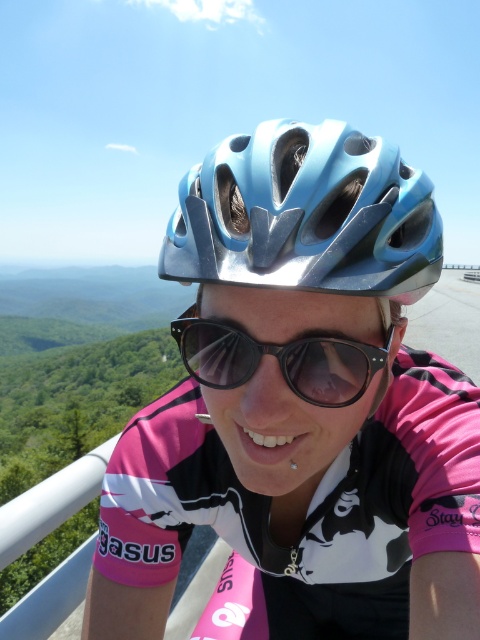
Can you confirm if blue metallic helmet at center is smaller than black matte sunglasses at center?

Indeed, blue metallic helmet at center has a smaller size compared to black matte sunglasses at center.

Is point (419, 220) closer to camera compared to point (300, 381)?

No, it is not.

In order to click on blue metallic helmet at center in this screenshot , I will do `click(305, 216)`.

Is blue glossy bicycle helmet at center smaller than blue metallic helmet at center?

Actually, blue glossy bicycle helmet at center might be larger than blue metallic helmet at center.

Does blue glossy bicycle helmet at center appear under blue metallic helmet at center?

Yes, blue glossy bicycle helmet at center is below blue metallic helmet at center.

Who is more forward, (384,180) or (298,273)?

Point (298,273) is more forward.

Where is `blue glossy bicycle helmet at center`? This screenshot has width=480, height=640. blue glossy bicycle helmet at center is located at coordinates (305, 216).

Between blue glossy bicycle helmet at center and black matte sunglasses at center, which one has more height?

Standing taller between the two is blue glossy bicycle helmet at center.

Which is more to the right, blue glossy bicycle helmet at center or black matte sunglasses at center?

Positioned to the right is blue glossy bicycle helmet at center.

Describe the element at coordinates (305, 216) in the screenshot. Image resolution: width=480 pixels, height=640 pixels. I see `blue glossy bicycle helmet at center` at that location.

Identify the location of blue glossy bicycle helmet at center. (305, 216).